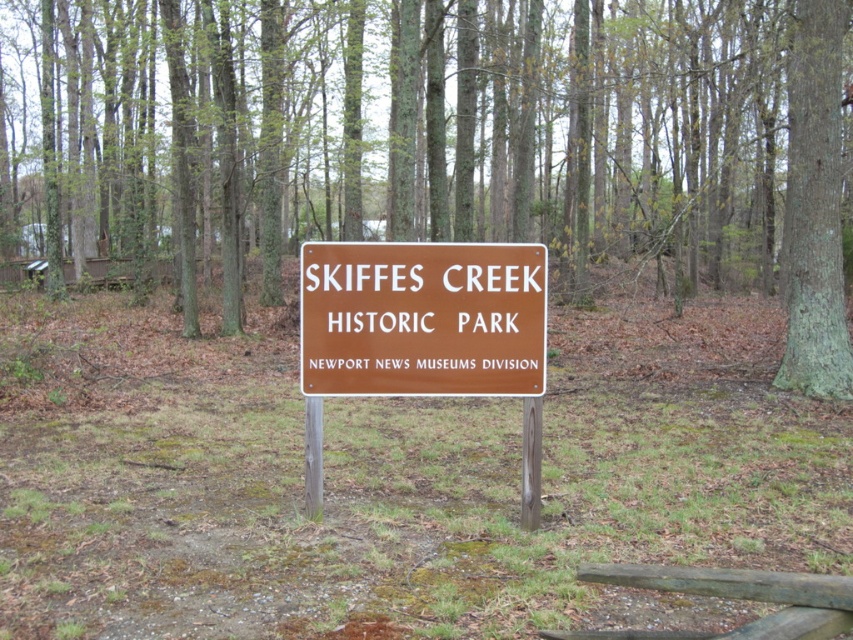
Is the position of smooth brown bark at center right more distant than that of brown wooden fence at lower right?

Yes, smooth brown bark at center right is further from the viewer.

Is smooth brown bark at center right to the left of brown wooden fence at lower right from the viewer's perspective?

In fact, smooth brown bark at center right is to the right of brown wooden fence at lower right.

Who is more distant from viewer, [834,96] or [793,611]?

The point [834,96] is behind.

Image resolution: width=853 pixels, height=640 pixels. In order to click on smooth brown bark at center right in this screenshot , I will do `click(814, 208)`.

Does green bark tree at center have a lesser height compared to brown wooden fence at lower right?

In fact, green bark tree at center may be taller than brown wooden fence at lower right.

You are a GUI agent. You are given a task and a screenshot of the screen. Output one action in this format:
    pyautogui.click(x=<x>, y=<y>)
    Task: Click on the green bark tree at center
    The image size is (853, 640).
    Given the screenshot: What is the action you would take?
    pyautogui.click(x=439, y=144)

From the picture: Which is more to the left, green bark tree at center or smooth brown bark at center right?

green bark tree at center

Measure the distance between green bark tree at center and smooth brown bark at center right.

32.99 feet

Is point (701, 177) positioned after point (790, 140)?

Yes.

Where is `green bark tree at center`? This screenshot has height=640, width=853. green bark tree at center is located at coordinates (439, 144).